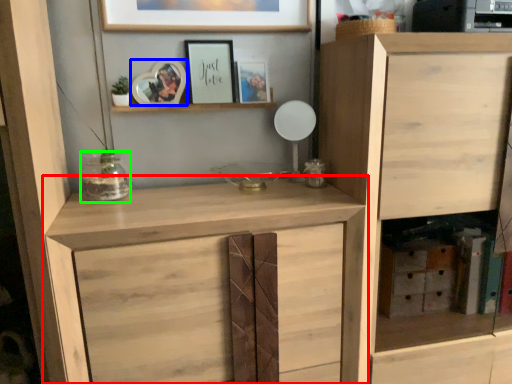
Question: Based on their relative distances, which object is nearer to cupboard (highlighted by a red box)? Choose from picture frame (highlighted by a blue box) and glass vase (highlighted by a green box).

Choices:
 (A) picture frame
 (B) glass vase

Answer: (B)